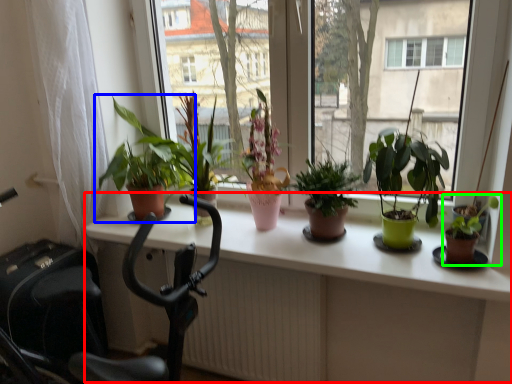
Question: Based on their relative distances, which object is farther from table (highlighted by a red box)? Choose from houseplant (highlighted by a blue box) and houseplant (highlighted by a green box).

Choices:
 (A) houseplant
 (B) houseplant

Answer: (B)